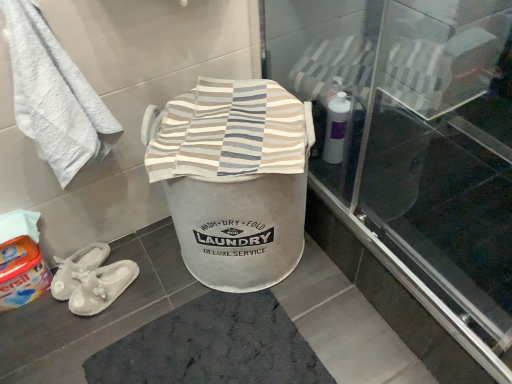
Identify the location of vacant area on the back side of white fabric slippers at lower left. Image resolution: width=512 pixels, height=384 pixels. (141, 243).